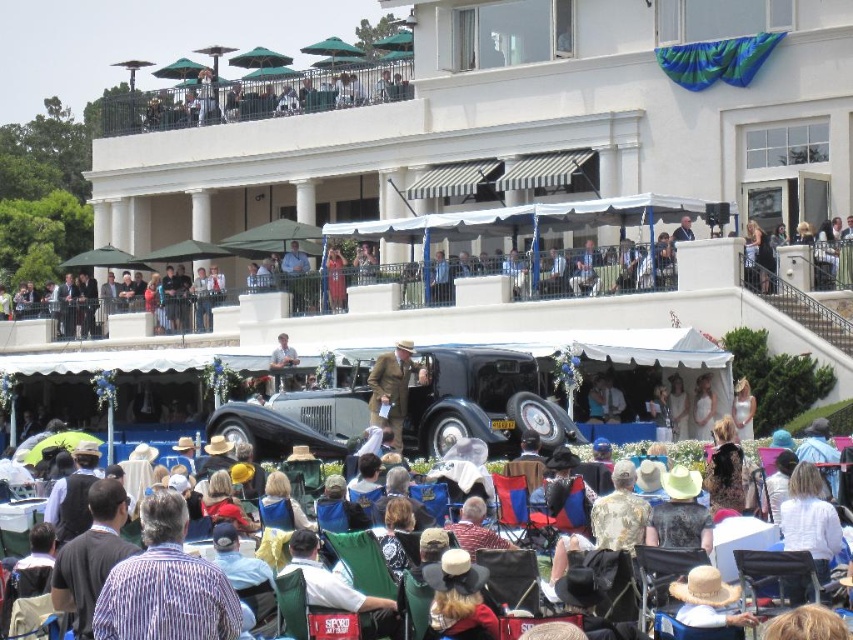
From the picture: Who is lower down, metallic silver chair at center or brown wool coat at center?

metallic silver chair at center

Is metallic silver chair at center to the left of brown wool coat at center from the viewer's perspective?

In fact, metallic silver chair at center is to the right of brown wool coat at center.

Is point (801, 588) positioned behind point (393, 380)?

That is False.

Identify the location of metallic silver chair at center. (775, 579).

Can you confirm if shiny black car at center is taller than brown wool coat at center?

Indeed, shiny black car at center has a greater height compared to brown wool coat at center.

Who is lower down, shiny black car at center or brown wool coat at center?

shiny black car at center

Between point (207, 432) and point (387, 372), which one is positioned in front?

Positioned in front is point (387, 372).

Identify the location of shiny black car at center. This screenshot has height=640, width=853. (480, 403).

Based on the photo, between shiny black car at center and striped cotton shirt at center, which one appears on the right side from the viewer's perspective?

shiny black car at center

Looking at this image, is shiny black car at center to the right of striped cotton shirt at center from the viewer's perspective?

Indeed, shiny black car at center is positioned on the right side of striped cotton shirt at center.

Describe the element at coordinates (480, 403) in the screenshot. The height and width of the screenshot is (640, 853). I see `shiny black car at center` at that location.

Locate an element on the screen. shiny black car at center is located at coordinates (480, 403).